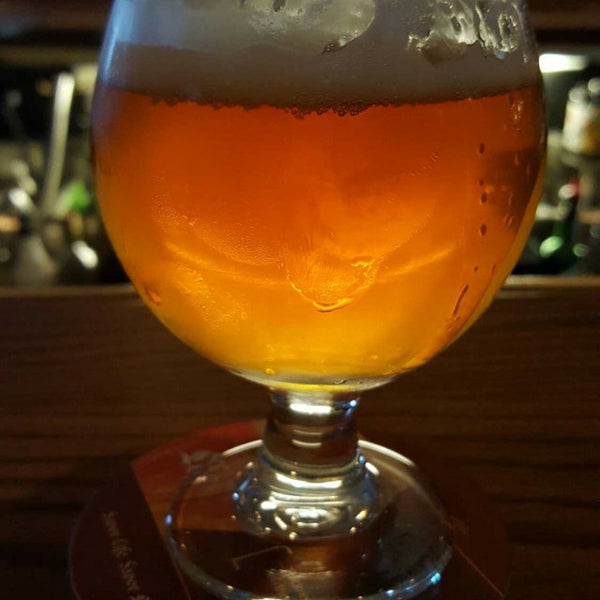
The image size is (600, 600). In order to click on round base of glass in this screenshot , I will do `click(392, 551)`, `click(220, 549)`.